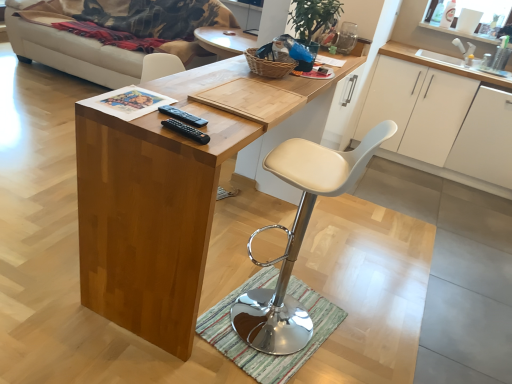
Question: Based on their sizes in the image, would you say beige fabric couch at upper left is bigger or smaller than white matte cabinet at upper right, acting as the first cabinetry starting from the left?

Choices:
 (A) big
 (B) small

Answer: (A)

Question: Considering the positions of point (145, 26) and point (445, 175), is point (145, 26) closer or farther from the camera than point (445, 175)?

Choices:
 (A) farther
 (B) closer

Answer: (A)

Question: Based on their relative distances, which object is farther from the beige fabric couch at upper left?

Choices:
 (A) white matte cabinet at right, marked as the first cabinetry in a right-to-left arrangement
 (B) wooden desk at center
 (C) black plastic remote at center
 (D) white matte cabinet at upper right, acting as the first cabinetry starting from the left
 (E) striped fabric doormat at lower center

Answer: (C)

Question: Estimate the real-world distances between objects in this image. Which object is closer to the white leather stool at center?

Choices:
 (A) black plastic remote at center
 (B) wooden desk at center
 (C) beige fabric couch at upper left
 (D) white matte cabinet at upper right, which is the second cabinetry in right-to-left order
 (E) striped fabric doormat at lower center

Answer: (E)